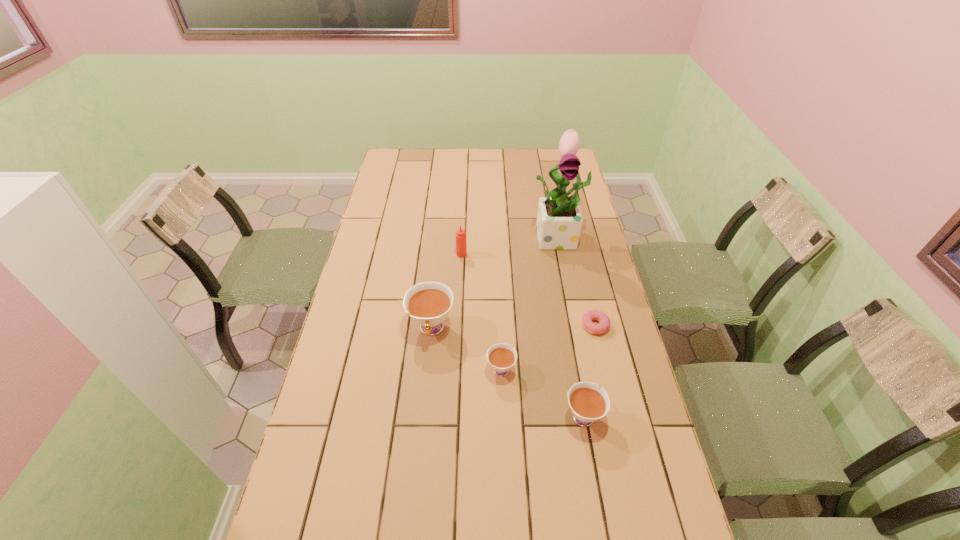
This screenshot has width=960, height=540. I want to click on vacant area between the Tabasco sauce and the tallest object, so click(x=511, y=246).

Identify the location of vacant region between the doughnut and the flower arrangement. (577, 281).

Locate an element on the screen. This screenshot has width=960, height=540. unoccupied area between the shortest teacup and the tallest teacup is located at coordinates (467, 349).

Find the location of a particular element. vacant area between the nearest object and the Tabasco sauce is located at coordinates pyautogui.click(x=522, y=334).

At what (x,y) coordinates should I click in order to perform the action: click on free spot between the second teacup from left to right and the fourth tallest object. Please return your answer as a coordinate pair (x, y). This screenshot has height=540, width=960. Looking at the image, I should click on click(x=541, y=392).

The width and height of the screenshot is (960, 540). What are the coordinates of `object that stands as the second closest to the shortest object` in the screenshot? It's located at (501, 357).

This screenshot has height=540, width=960. In order to click on object identified as the second closest to the fourth tallest object in this screenshot , I will do `click(604, 322)`.

At what (x,y) coordinates should I click in order to perform the action: click on teacup identified as the third closest to the doughnut. Please return your answer as a coordinate pair (x, y). Image resolution: width=960 pixels, height=540 pixels. Looking at the image, I should click on (428, 303).

The image size is (960, 540). In order to click on teacup that stands as the second closest to the doughnut in this screenshot , I will do `click(501, 357)`.

Locate an element on the screen. The image size is (960, 540). vacant space that satisfies the following two spatial constraints: 1. on the front-facing side of the flower arrangement; 2. on the left side of the shortest object is located at coordinates (577, 326).